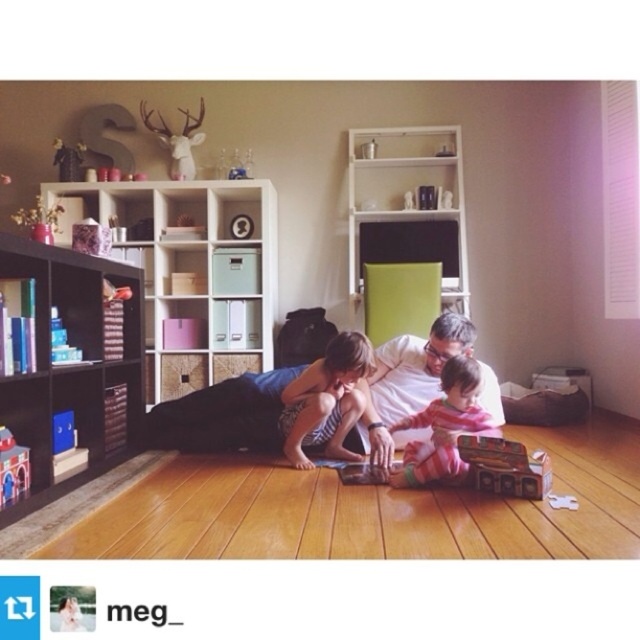
Question: Can you confirm if white cotton shirt at center is positioned above wooden toy at upper left?

Choices:
 (A) no
 (B) yes

Answer: (A)

Question: Is matte black bookshelf at left below wooden toy at upper left?

Choices:
 (A) no
 (B) yes

Answer: (B)

Question: Can you confirm if white cotton shirt at center is thinner than white matte deer head at upper left?

Choices:
 (A) no
 (B) yes

Answer: (A)

Question: Estimate the real-world distances between objects in this image. Which object is farther from the white matte deer head at upper left?

Choices:
 (A) red plastic toy at lower left
 (B) black matte bookshelf at left

Answer: (A)

Question: Estimate the real-world distances between objects in this image. Which object is farther from the matte blue toy at left?

Choices:
 (A) dark blue fabric at center
 (B) matte black bookshelf at left
 (C) red plastic toy at lower left

Answer: (B)

Question: Which of the following is the farthest from the observer?

Choices:
 (A) (48, 230)
 (B) (61, 401)
 (C) (413, 401)
 (D) (120, 294)

Answer: (C)